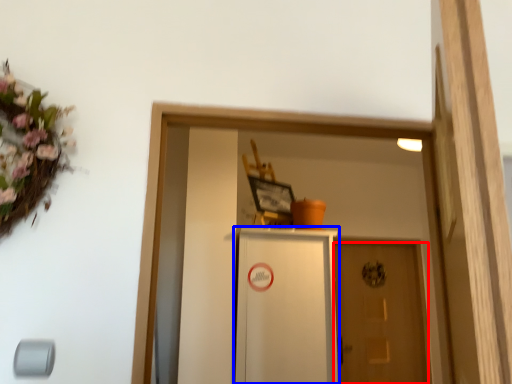
Question: Among these objects, which one is farthest to the camera, door (highlighted by a red box) or cabinetry (highlighted by a blue box)?

Choices:
 (A) door
 (B) cabinetry

Answer: (A)